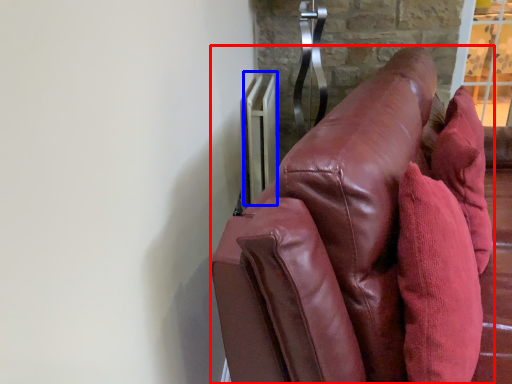
Question: Which object is further to the camera taking this photo, furniture (highlighted by a red box) or radiator (highlighted by a blue box)?

Choices:
 (A) furniture
 (B) radiator

Answer: (B)